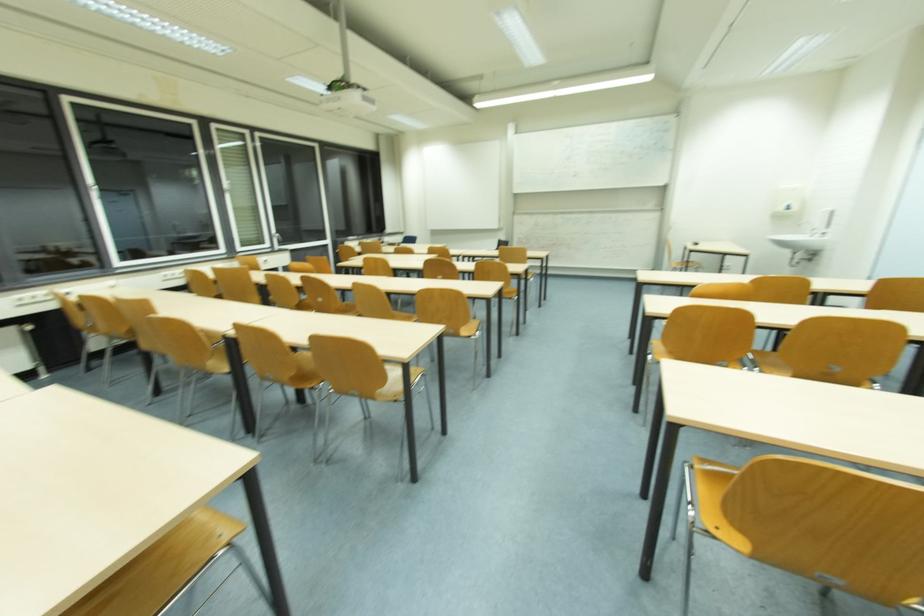
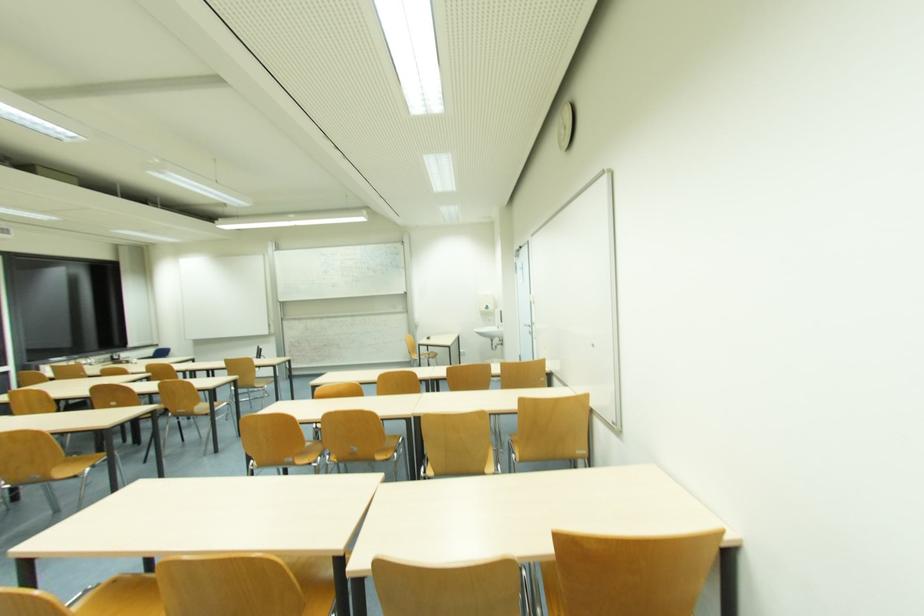
Which direction would the cameraman need to move to produce the second image?

The cameraman moved toward right, backward.